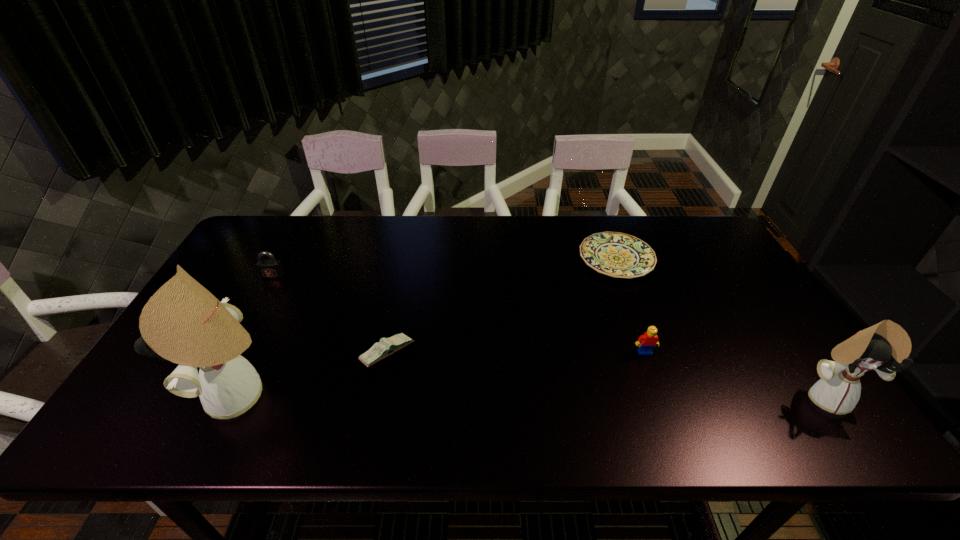
To make them evenly spaced by inserting another doll among them, please locate a free space for this new doll. Please provide its 2D coordinates. Your answer should be formatted as a tuple, i.e. [(x, y)], where the tuple contains the x and y coordinates of a point satisfying the conditions above.

[(534, 396)]